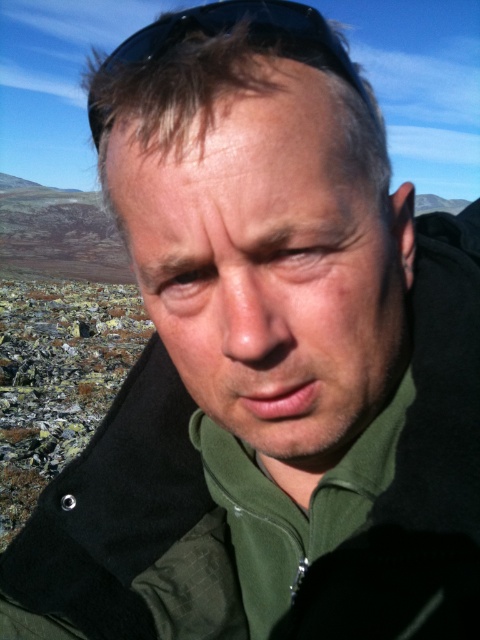
You are standing in front of a mountain landscape and want to place a small flag at the point labeled as point (x=343, y=378). If your hand is currently 13 inches away from that point, can you accurately place the flag without moving your hand closer?

The point labeled point (x=343, y=378) is 13.59 inches away from the viewer. Since your hand is only 13 inches away, you need to move it slightly closer to reach the exact location.